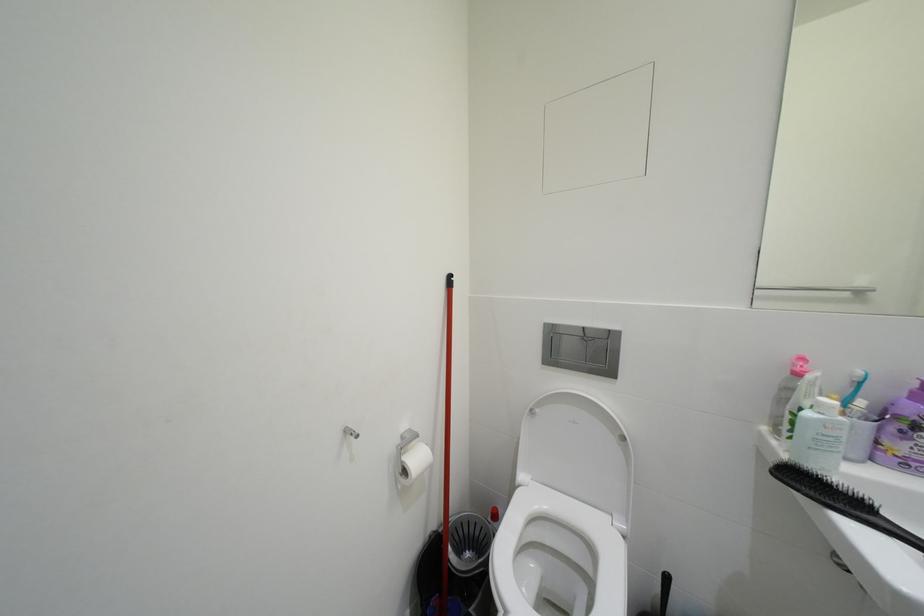
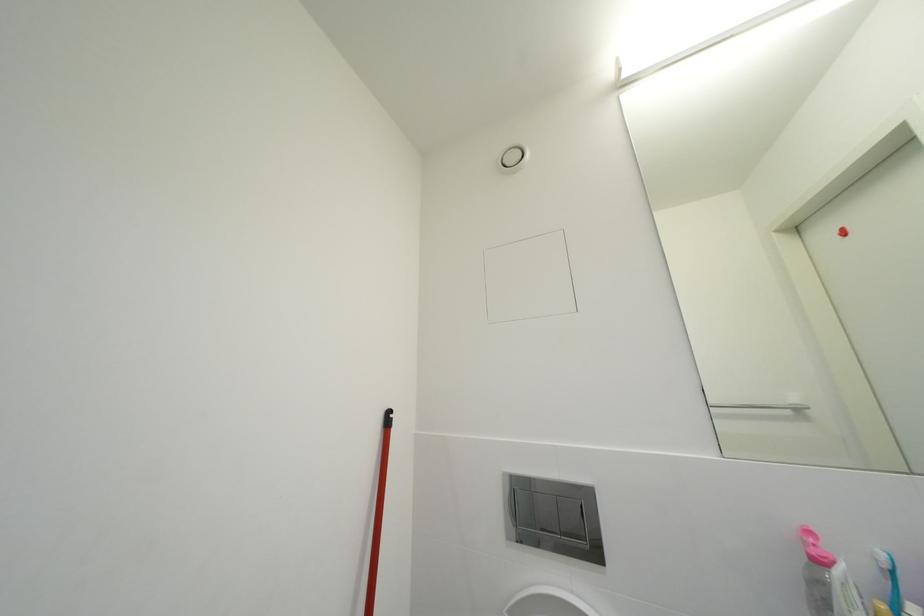
Looking at this image, what movement of the cameraman would produce the second image?

The cameraman walked toward right, forward.